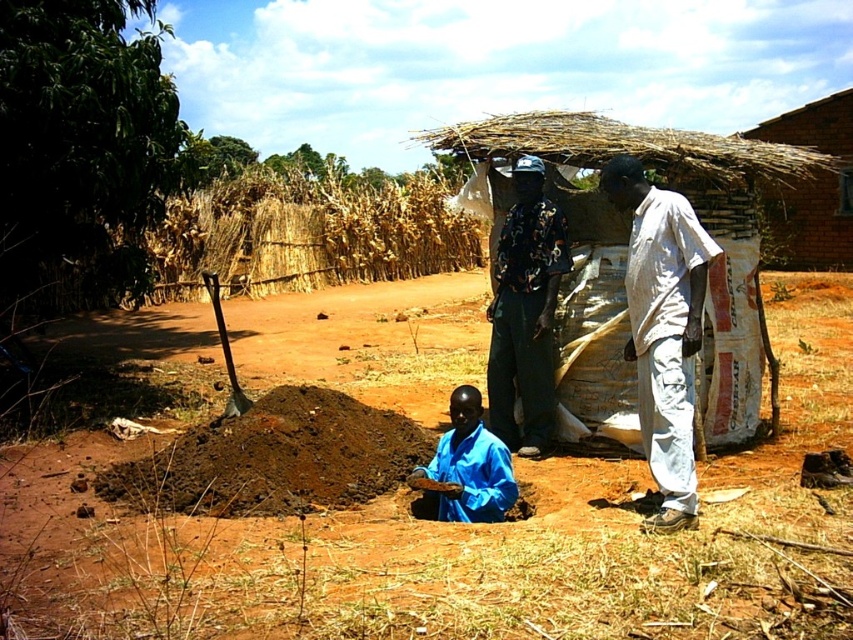
How much distance is there between dry straw at upper center and black printed shirt at center?

dry straw at upper center is 13.50 meters from black printed shirt at center.

Is dry straw at upper center positioned before black printed shirt at center?

No, it is behind black printed shirt at center.

What do you see at coordinates (309, 234) in the screenshot? I see `dry straw at upper center` at bounding box center [309, 234].

Locate an element on the screen. The image size is (853, 640). dry straw at upper center is located at coordinates (309, 234).

Does brown soil at center appear over dry straw at upper center?

No.

Which is more to the left, brown soil at center or dry straw at upper center?

Positioned to the left is dry straw at upper center.

Describe the element at coordinates (456, 541) in the screenshot. I see `brown soil at center` at that location.

At what (x,y) coordinates should I click in order to perform the action: click on brown soil at center. Please return your answer as a coordinate pair (x, y). This screenshot has width=853, height=640. Looking at the image, I should click on (456, 541).

Does dry straw at upper center have a greater height compared to blue fabric shirt at lower center?

Correct, dry straw at upper center is much taller as blue fabric shirt at lower center.

Is the position of dry straw at upper center more distant than that of blue fabric shirt at lower center?

Yes, it is.

Image resolution: width=853 pixels, height=640 pixels. What are the coordinates of `dry straw at upper center` in the screenshot? It's located at (309, 234).

Identify the location of dry straw at upper center. (309, 234).